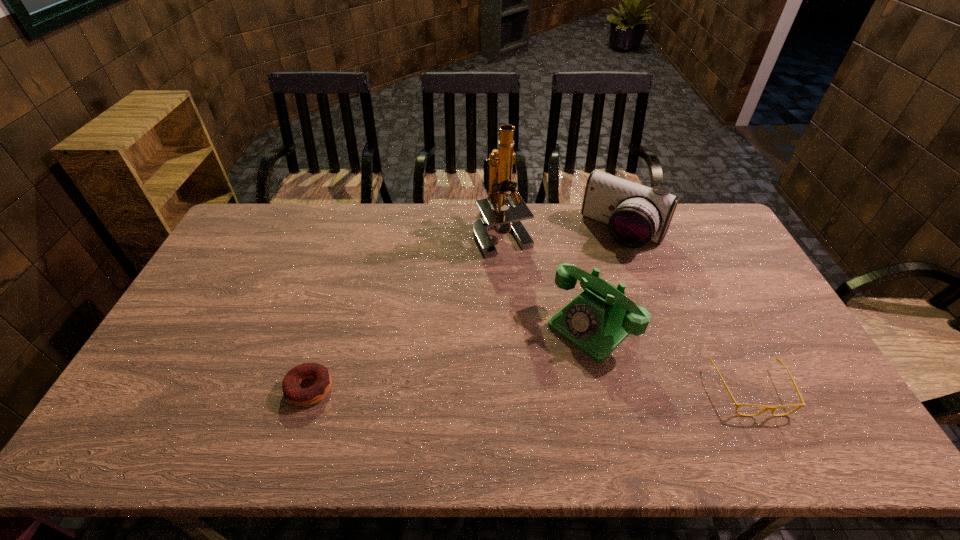
Find the location of a particular element. The width and height of the screenshot is (960, 540). object located in the right edge section of the desktop is located at coordinates (772, 408).

Where is `object situated at the near right corner`? The image size is (960, 540). object situated at the near right corner is located at coordinates (772, 408).

Find the location of `free location at the far edge of the desktop`. free location at the far edge of the desktop is located at coordinates (284, 235).

The image size is (960, 540). In the image, there is a desktop. What are the coordinates of `free space at the near edge` in the screenshot? It's located at (761, 397).

The height and width of the screenshot is (540, 960). Identify the location of free region at the left edge. (175, 355).

Identify the location of vacant space at the right edge of the desktop. (766, 340).

At what (x,y) coordinates should I click in order to perform the action: click on vacant space at the near left corner. Please return your answer as a coordinate pair (x, y). Looking at the image, I should click on (187, 390).

In the image, there is a desktop. In order to click on vacant space at the near right corner in this screenshot , I will do `click(782, 382)`.

The image size is (960, 540). Find the location of `vacant area between the camcorder and the doughnut`. vacant area between the camcorder and the doughnut is located at coordinates (467, 310).

The image size is (960, 540). I want to click on unoccupied position between the spectacles and the leftmost object, so click(x=530, y=389).